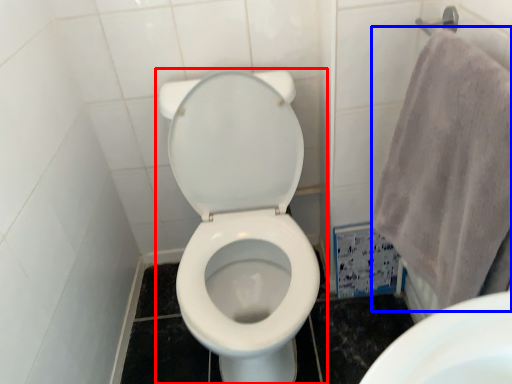
Question: Among these objects, which one is farthest to the camera, toilet (highlighted by a red box) or bath towel (highlighted by a blue box)?

Choices:
 (A) toilet
 (B) bath towel

Answer: (A)